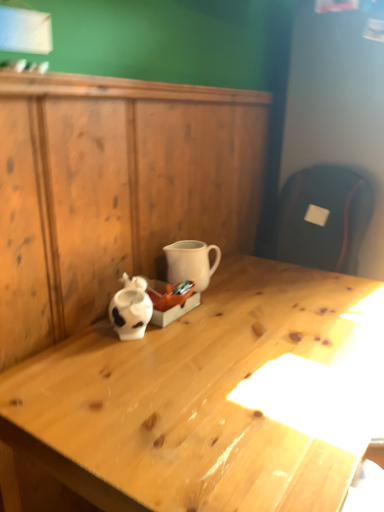
Image resolution: width=384 pixels, height=512 pixels. Find the location of `vacant area that is situated to the right of white matte coffee cup at center`. vacant area that is situated to the right of white matte coffee cup at center is located at coordinates (246, 293).